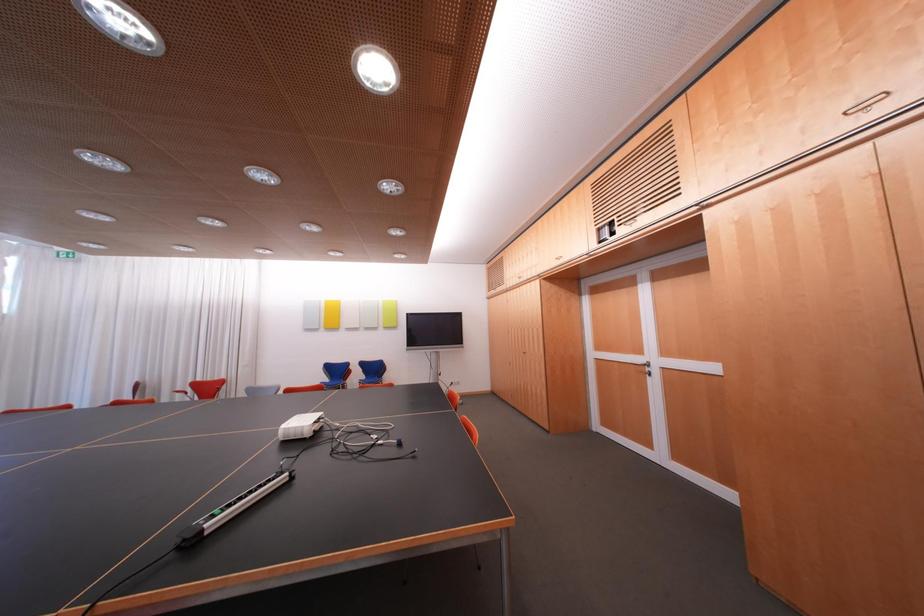
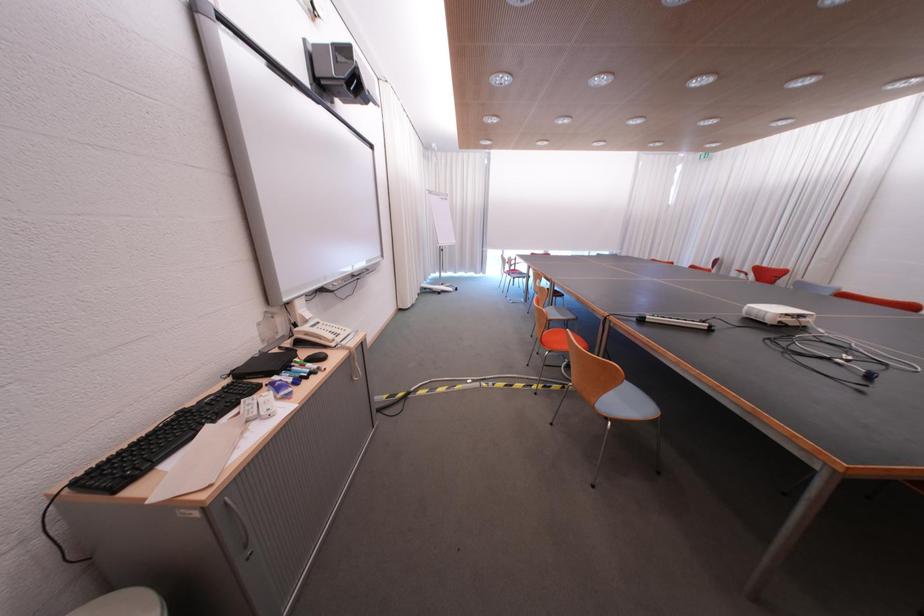
First-person continuous shooting, in which direction is the camera rotating?

The camera rotated toward left-down.